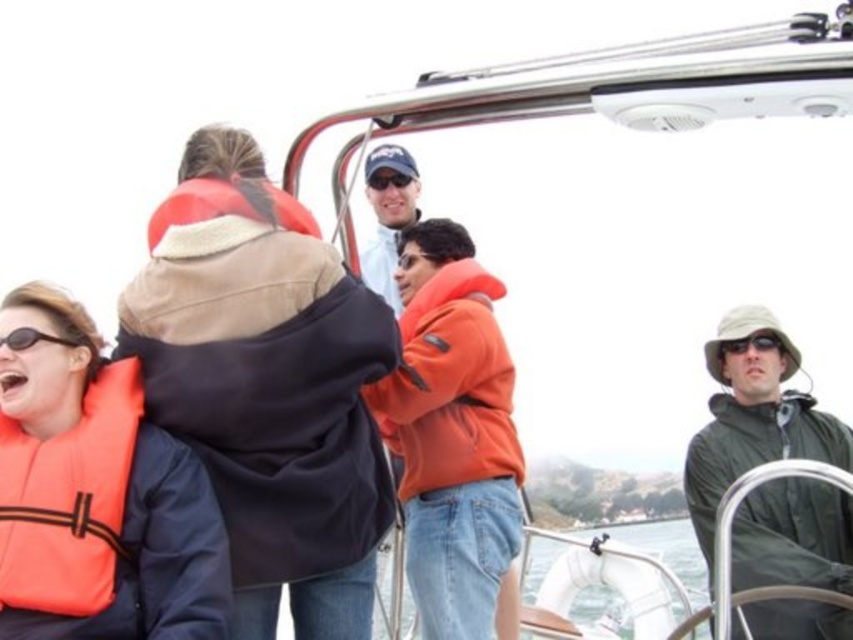
You are a photographer trying to capture a candid shot of the green matte jacket at center and the black plastic sunglasses at lower left. Since you want both subjects in focus, which one should you adjust your camera focus on first to ensure the closest object is sharp?

The green matte jacket at center is closer to the viewer than the black plastic sunglasses at lower left, so you should focus on the green matte jacket at center first to ensure depth of field captures both subjects properly.

Consider the image. You are a photographer taking a picture of the green matte jacket at center and the black plastic sunglasses at lower left. Which object should you focus on first if you want to capture both in the same frame without moving the camera?

The green matte jacket at center is much taller than the black plastic sunglasses at lower left, so you should focus on the green matte jacket at center first to ensure it is in focus before the smaller object.

Based on the photo, you are a safety inspector checking the boat for proper equipment placement. According to the image, is the orange life vest at lower left placed to the right or left of the orange life jacket at left?

The orange life vest at lower left is positioned on the right side of orange life jacket at left, so it is placed to the right of the orange life jacket at left.